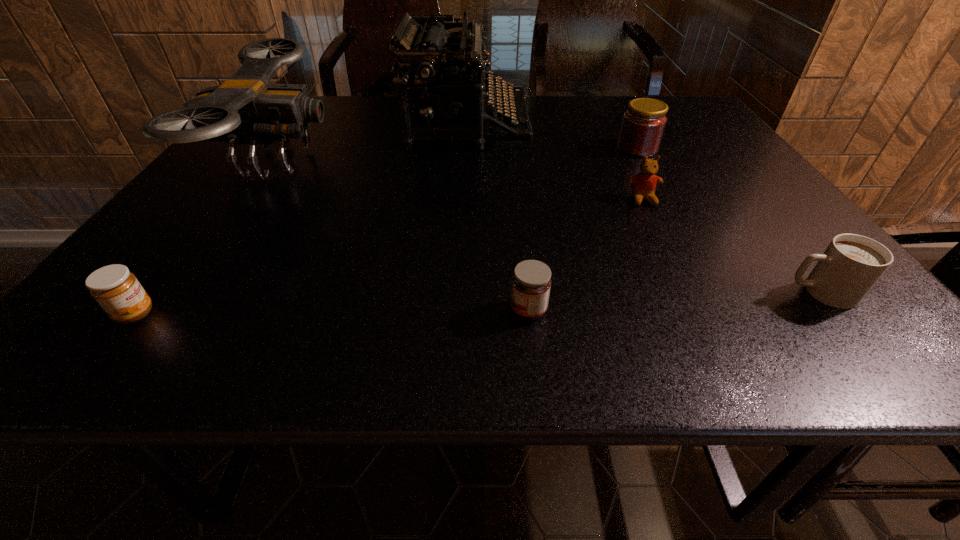
Where is `jam present at the left edge`? jam present at the left edge is located at coordinates (117, 290).

Where is `object that is at the right edge`? This screenshot has width=960, height=540. object that is at the right edge is located at coordinates (850, 266).

I want to click on object that is at the far left corner, so click(x=246, y=109).

Image resolution: width=960 pixels, height=540 pixels. I want to click on object located in the near left corner section of the desktop, so click(x=117, y=290).

Find the location of a particular element. The image size is (960, 540). free space at the far edge is located at coordinates (605, 126).

Identify the location of free space at the near edge of the desktop. This screenshot has width=960, height=540. (519, 338).

You are a GUI agent. You are given a task and a screenshot of the screen. Output one action in this format:
    pyautogui.click(x=<x>, y=<y>)
    Task: Click on the vacant space at the left edge of the desktop
    The image size is (960, 540).
    Given the screenshot: What is the action you would take?
    pyautogui.click(x=205, y=253)

This screenshot has width=960, height=540. Find the location of `free location at the right edge of the desktop`. free location at the right edge of the desktop is located at coordinates (762, 274).

You are a GUI agent. You are given a task and a screenshot of the screen. Output one action in this format:
    pyautogui.click(x=<x>, y=<y>)
    Task: Click on the free spot between the typewriter and the tallest jam
    
    Given the screenshot: What is the action you would take?
    pyautogui.click(x=552, y=137)

The width and height of the screenshot is (960, 540). Identify the location of vacant area between the teddy bear and the typewriter. (555, 162).